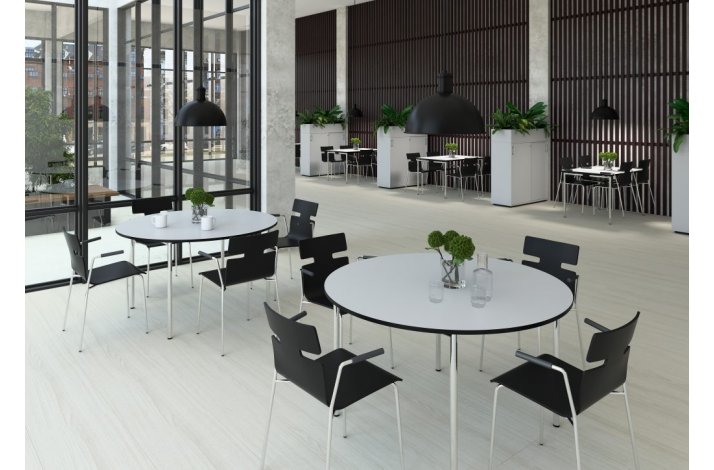
You are a GUI agent. You are given a task and a screenshot of the screen. Output one action in this format:
    pyautogui.click(x=<x>, y=<y>)
    Task: Click on the large plants on top of dividers
    Image resolution: width=714 pixels, height=470 pixels.
    Given the screenshot: What is the action you would take?
    pyautogui.click(x=321, y=117), pyautogui.click(x=393, y=114), pyautogui.click(x=523, y=125), pyautogui.click(x=685, y=124)